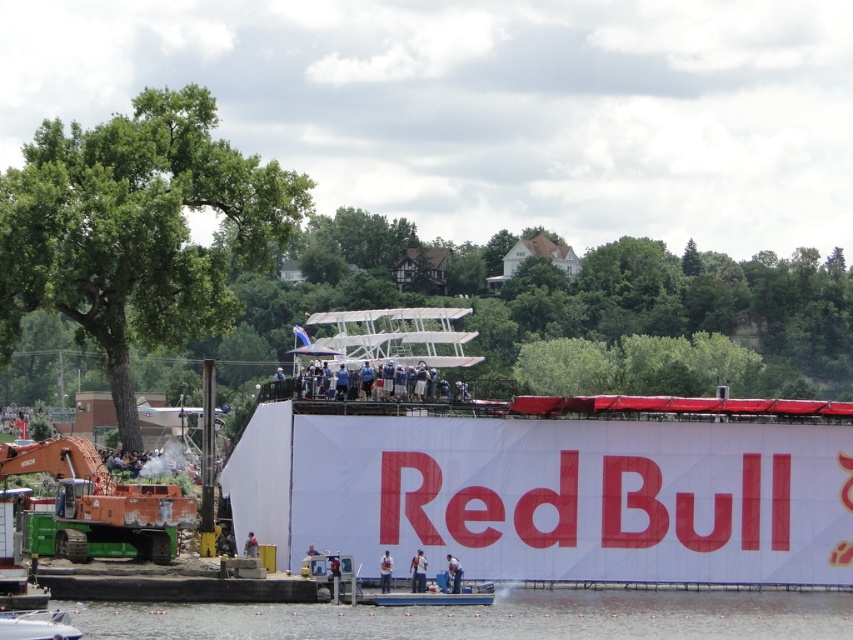
You are standing at the edge of the water and see the blue fabric crowd at center marked by the point (376,378). If you walk straight towards the point, will you reach the blue fabric crowd at center before the water ends?

The blue fabric crowd at center is represented by point (376,378), so yes, walking straight towards that point would lead you to the crowd before reaching the end of the water.

You are a photographer standing at the edge of the water, aiming to capture the clear water at lower center in your shot. Based on its coordinates, where should you position your camera to ensure it is centered in the frame?

To center the clear water at lower center, position your camera so that the crosshairs align with the coordinates provided, specifically at point 0.964 on the x and 0.574 on the y axis.

You are standing at the center of the platform and want to find the dark blue uniform at lower center. In which direction should you look to locate it?

To locate the dark blue uniform at lower center, you should look towards the lower center direction since its 2D location is at point (454, 572).